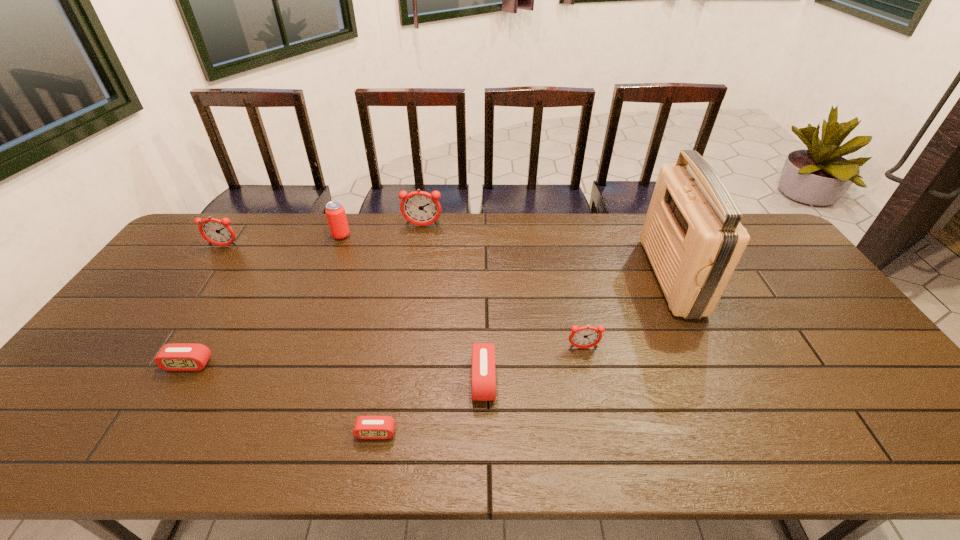
Locate which alarm clock ranks second in proximity to the tallest object. Please provide its 2D coordinates. Your answer should be formatted as a tuple, i.e. [(x, y)], where the tuple contains the x and y coordinates of a point satisfying the conditions above.

[(483, 376)]

Locate which reddish-pink alarm clock ranks second in proximity to the second alarm clock from right to left. Please provide its 2D coordinates. Your answer should be formatted as a tuple, i.e. [(x, y)], where the tuple contains the x and y coordinates of a point satisfying the conditions above.

[(420, 208)]

The height and width of the screenshot is (540, 960). I want to click on reddish-pink alarm clock that is the closest one to the second smallest reddish-pink alarm clock, so click(x=420, y=208).

The image size is (960, 540). Find the location of `the second closest pink alarm clock to the radio receiver`. the second closest pink alarm clock to the radio receiver is located at coordinates (x=366, y=427).

Where is `the closest pink alarm clock to the third shortest object`? The image size is (960, 540). the closest pink alarm clock to the third shortest object is located at coordinates (366, 427).

Where is `blank area in the image that satisfies the following two spatial constraints: 1. on the front-facing side of the beige radio receiver; 2. on the front-facing side of the seventh object from right to left`? This screenshot has height=540, width=960. blank area in the image that satisfies the following two spatial constraints: 1. on the front-facing side of the beige radio receiver; 2. on the front-facing side of the seventh object from right to left is located at coordinates (713, 364).